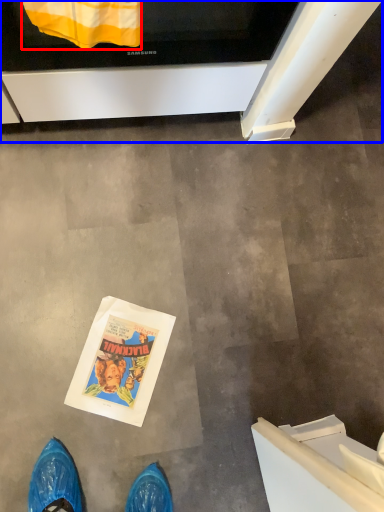
Question: Among these objects, which one is nearest to the camera, blanket (highlighted by a red box) or oven (highlighted by a blue box)?

Choices:
 (A) blanket
 (B) oven

Answer: (A)